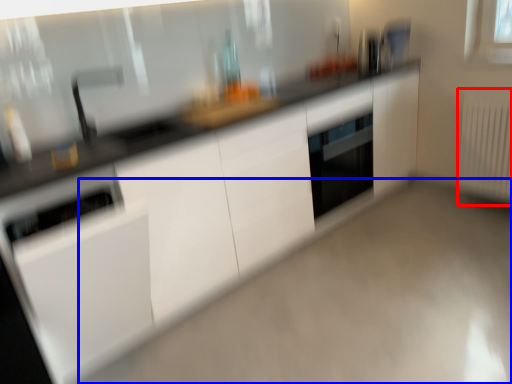
Question: Which object appears farthest to the camera in this image, radiator (highlighted by a red box) or plain (highlighted by a blue box)?

Choices:
 (A) radiator
 (B) plain

Answer: (A)